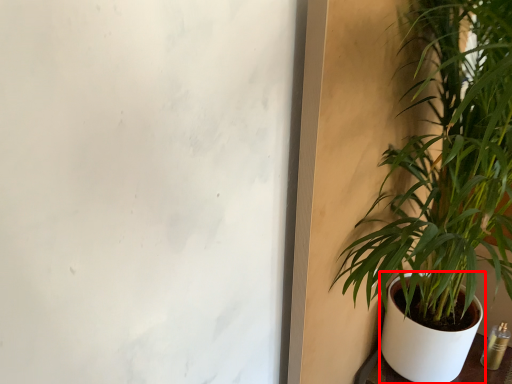
Question: From the image, what is the correct spatial relationship of flowerpot (annotated by the red box) in relation to houseplant?

Choices:
 (A) right
 (B) left

Answer: (A)